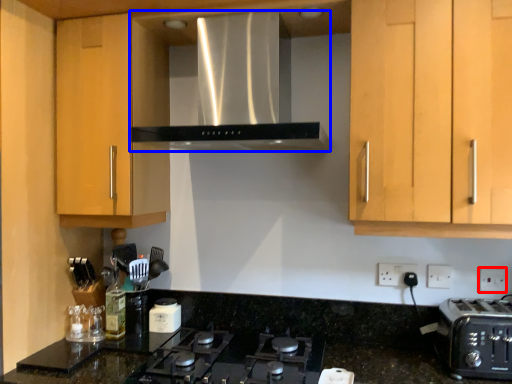
Question: Which object appears farthest to the camera in this image, electric outlet (highlighted by a red box) or home appliance (highlighted by a blue box)?

Choices:
 (A) electric outlet
 (B) home appliance

Answer: (A)